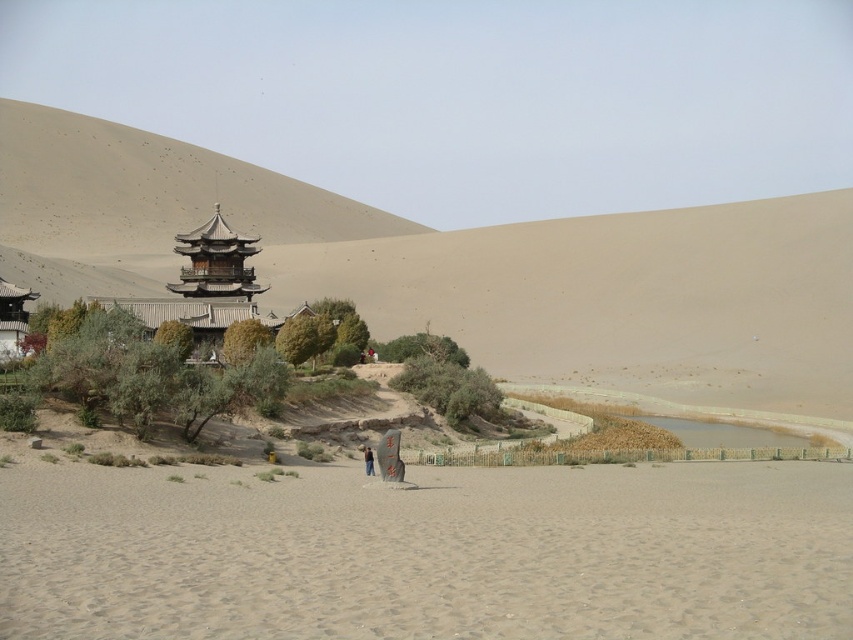
Can you confirm if smooth sand at lower center is positioned to the left of brown fabric person at center?

In fact, smooth sand at lower center is to the right of brown fabric person at center.

Does smooth sand at lower center appear over brown fabric person at center?

Correct, smooth sand at lower center is located above brown fabric person at center.

Does point (431, 579) come closer to viewer compared to point (370, 467)?

Yes, it is in front of point (370, 467).

Locate an element on the screen. smooth sand at lower center is located at coordinates (428, 554).